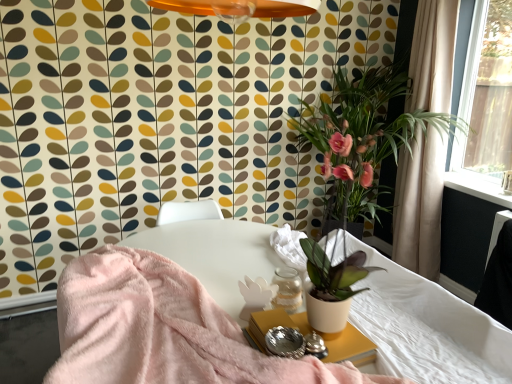
Question: Should I look upward or downward to see matte white pot at center?

Choices:
 (A) down
 (B) up

Answer: (B)

Question: Is white fabric mattress at lower right smaller than matte white pot at center?

Choices:
 (A) yes
 (B) no

Answer: (A)

Question: Is white fabric mattress at lower right positioned behind matte white pot at center?

Choices:
 (A) yes
 (B) no

Answer: (B)

Question: Is white fabric mattress at lower right to the left of matte white pot at center from the viewer's perspective?

Choices:
 (A) no
 (B) yes

Answer: (B)

Question: Can you confirm if white fabric mattress at lower right is wider than matte white pot at center?

Choices:
 (A) no
 (B) yes

Answer: (A)

Question: Considering the relative sizes of white fabric mattress at lower right and matte white pot at center in the image provided, is white fabric mattress at lower right thinner than matte white pot at center?

Choices:
 (A) yes
 (B) no

Answer: (A)

Question: From a real-world perspective, is white fabric mattress at lower right below matte white pot at center?

Choices:
 (A) yes
 (B) no

Answer: (A)

Question: Does white matte side table at lower center appear on the right side of matte white pot at center?

Choices:
 (A) yes
 (B) no

Answer: (B)

Question: From a real-world perspective, is white matte side table at lower center on matte white pot at center?

Choices:
 (A) yes
 (B) no

Answer: (B)

Question: Does white matte side table at lower center turn towards matte white pot at center?

Choices:
 (A) no
 (B) yes

Answer: (A)

Question: From the image's perspective, is white matte side table at lower center beneath matte white pot at center?

Choices:
 (A) no
 (B) yes

Answer: (B)

Question: Is white matte side table at lower center not close to matte white pot at center?

Choices:
 (A) yes
 (B) no

Answer: (A)

Question: Is the position of white matte side table at lower center less distant than that of matte white pot at center?

Choices:
 (A) yes
 (B) no

Answer: (A)

Question: Is white matte side table at lower center positioned far away from white fabric mattress at lower right?

Choices:
 (A) no
 (B) yes

Answer: (A)